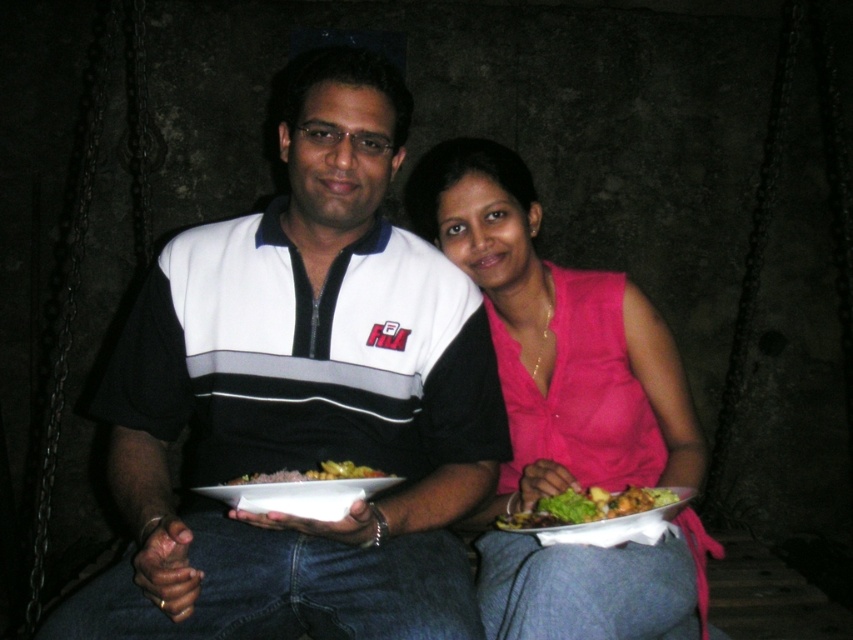
You are a photographer trying to capture a closeup of the green leafy vegetables at lower right without including the white striped polo shirt at center in the frame. Is this possible given their positions?

The white striped polo shirt at center is located above the green leafy vegetables at lower right, so it may be possible to angle the camera downward to focus solely on the green leafy vegetables at lower right while avoiding the polo shirt.

You are a photographer trying to capture a closeup shot of the white glossy plate at center. You need to ensure that the white striped polo shirt at center does not block the plate in the photo. Based on the scene description, can you determine if the shirt will interfere with the plate in the shot?

The white striped polo shirt at center is 6.90 inches away from the white glossy plate at center. Since they are separated by this distance, the shirt will not block the plate in the photo.